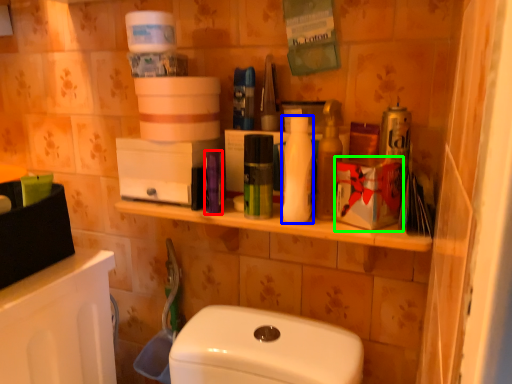
Question: Based on their relative distances, which object is farther from toiletry (highlighted by a red box)? Choose from toiletry (highlighted by a blue box) and box (highlighted by a green box).

Choices:
 (A) toiletry
 (B) box

Answer: (B)